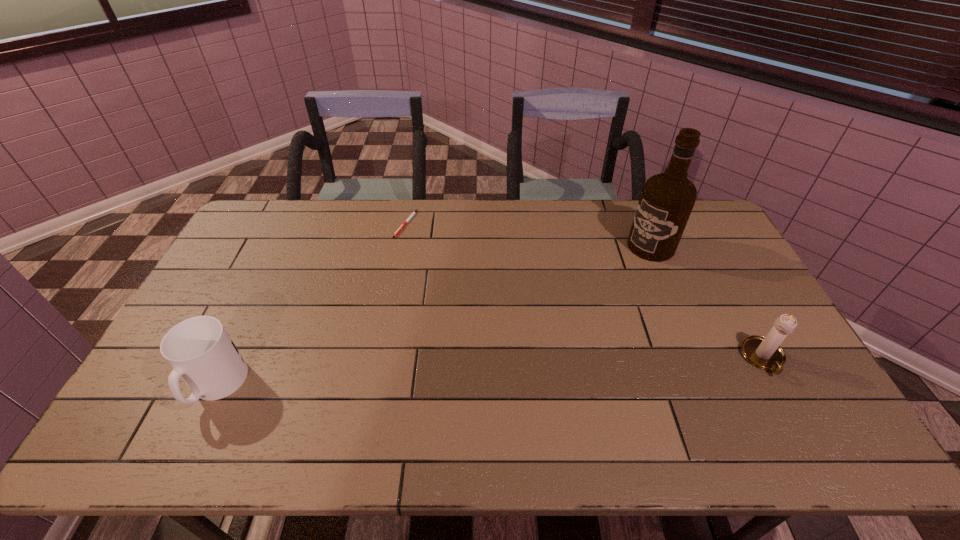
The image size is (960, 540). I want to click on the leftmost object, so click(x=199, y=349).

Locate an element on the screen. This screenshot has width=960, height=540. candle holder is located at coordinates (765, 353).

The image size is (960, 540). Identify the location of the tallest object. (667, 199).

You are a GUI agent. You are given a task and a screenshot of the screen. Output one action in this format:
    pyautogui.click(x=<x>, y=<y>)
    Task: Click on the alcohol
    Image resolution: width=960 pixels, height=540 pixels.
    Given the screenshot: What is the action you would take?
    pyautogui.click(x=667, y=199)

Find the location of a particular element. The image size is (960, 540). pen is located at coordinates (401, 227).

You are a GUI agent. You are given a task and a screenshot of the screen. Output one action in this format:
    pyautogui.click(x=<x>, y=<y>)
    Task: Click on the shortest object
    The image size is (960, 540).
    Given the screenshot: What is the action you would take?
    pyautogui.click(x=401, y=227)

Image resolution: width=960 pixels, height=540 pixels. Find the location of `vacant space situated on the handle side of the rightmost object`. vacant space situated on the handle side of the rightmost object is located at coordinates (788, 403).

Where is `vacant space situated 0.350m on the label of the second object from right to left`? The width and height of the screenshot is (960, 540). vacant space situated 0.350m on the label of the second object from right to left is located at coordinates (566, 306).

You are a GUI agent. You are given a task and a screenshot of the screen. Output one action in this format:
    pyautogui.click(x=<x>, y=<y>)
    Task: Click on the free space located 0.050m on the label of the second object from right to left
    
    Given the screenshot: What is the action you would take?
    (628, 262)

Locate an element on the screen. blank space located on the label of the second object from right to left is located at coordinates (609, 276).